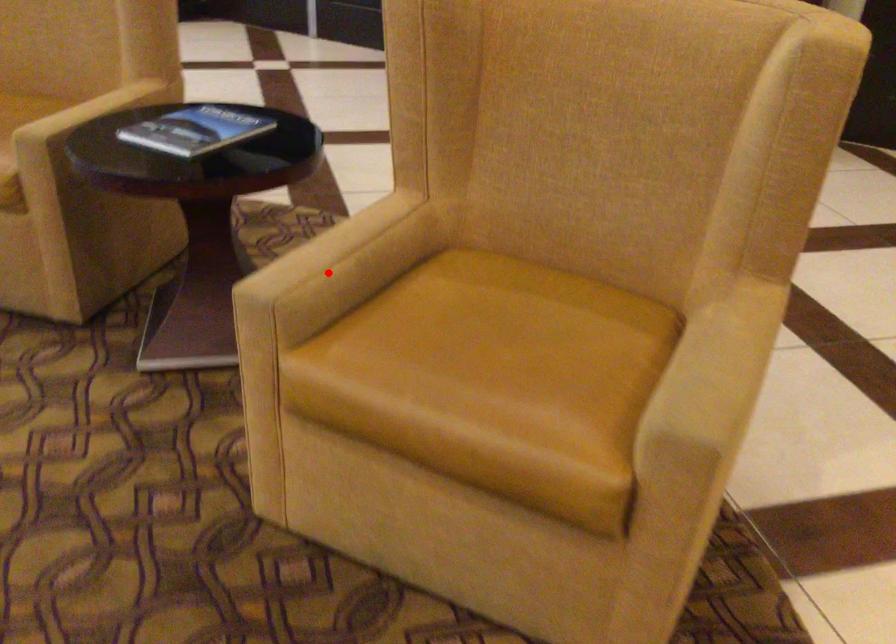
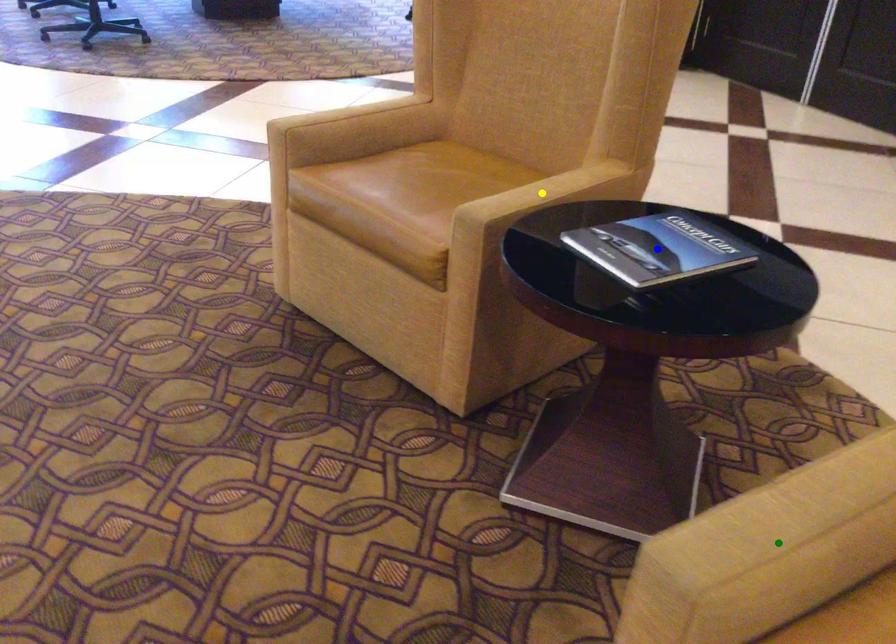
Question: I am providing you with two images of the same scene from different viewpoints. A red point is marked on the first image. You are given multiple points on the second image. Can you choose the point in image 2 that corresponds to the point in image 1?

Choices:
 (A) yellow point
 (B) green point
 (C) blue point

Answer: (B)